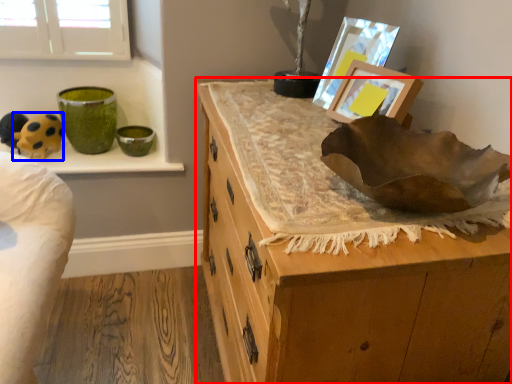
Question: Which object is closer to the camera taking this photo, chest of drawers (highlighted by a red box) or animal (highlighted by a blue box)?

Choices:
 (A) chest of drawers
 (B) animal

Answer: (A)